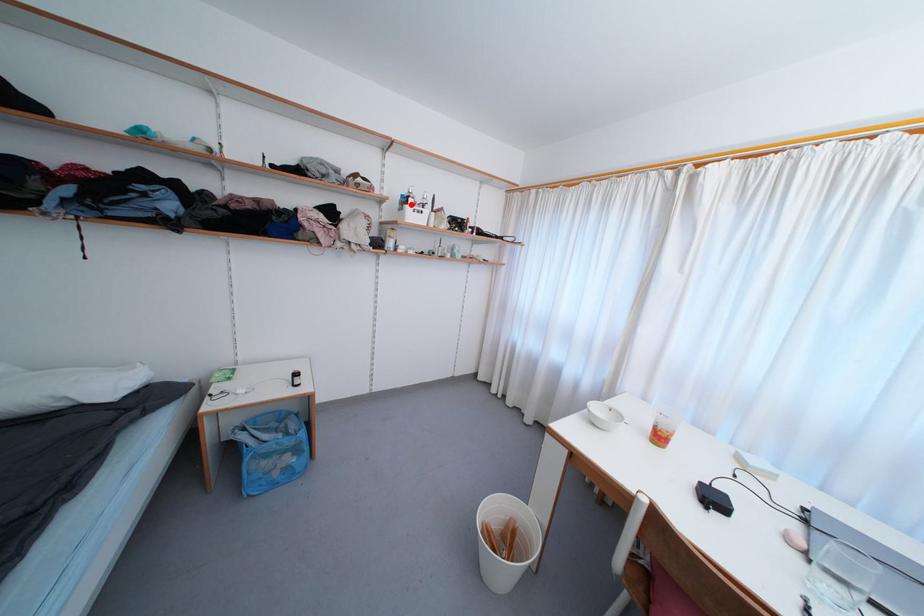
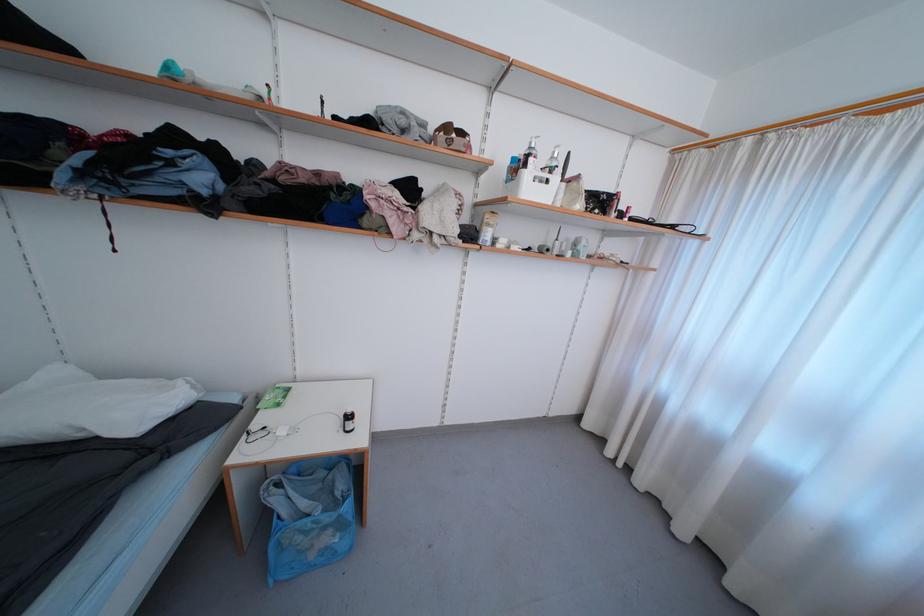
Where in the second image is the point corresponding to the highlighted location from the first image?

(529, 168)